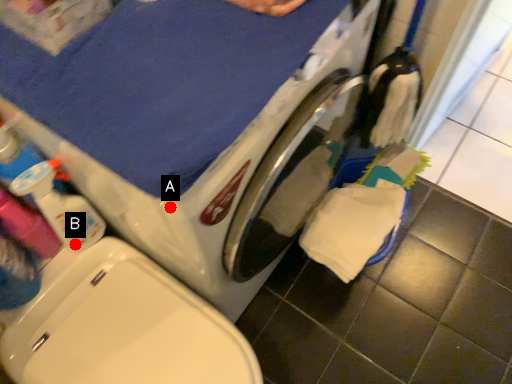
Question: Two points are circled on the image, labeled by A and B beside each circle. Among these points, which one is farthest from the camera?

Choices:
 (A) A is further
 (B) B is further

Answer: (B)